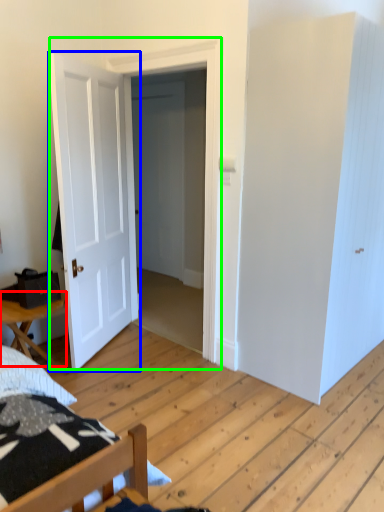
Question: Estimate the real-world distances between objects in this image. Which object is closer to table (highlighted by a red box), door (highlighted by a blue box) or door (highlighted by a green box)?

Choices:
 (A) door
 (B) door

Answer: (A)